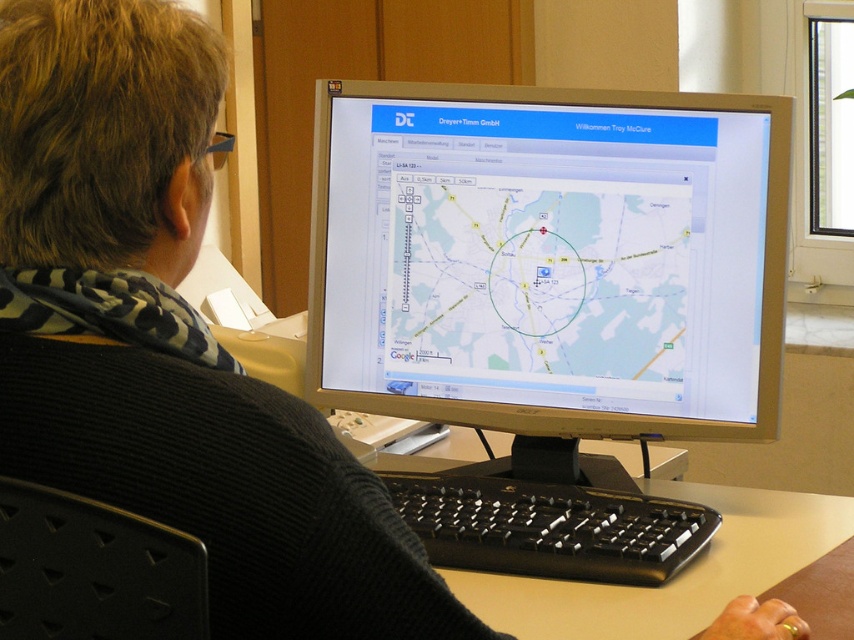
Is transparent map at center bigger than black plastic keyboard at center?

Yes, transparent map at center is bigger than black plastic keyboard at center.

Does point (405, 177) come farther from viewer compared to point (442, 545)?

Yes, it is behind point (442, 545).

This screenshot has width=854, height=640. I want to click on transparent map at center, so click(x=534, y=284).

Can you confirm if silver metallic monitor at center is bigger than black plastic keyboard at center?

Yes, silver metallic monitor at center is bigger than black plastic keyboard at center.

Does silver metallic monitor at center have a lesser height compared to black plastic keyboard at center?

No.

Is point (495, 170) behind point (439, 483)?

Yes, point (495, 170) is farther from viewer.

Find the location of a particular element. silver metallic monitor at center is located at coordinates (550, 259).

Is silver metallic monitor at center below transparent map at center?

No.

Is point (685, 314) positioned after point (685, 268)?

Yes.

Locate an element on the screen. The image size is (854, 640). silver metallic monitor at center is located at coordinates (550, 259).